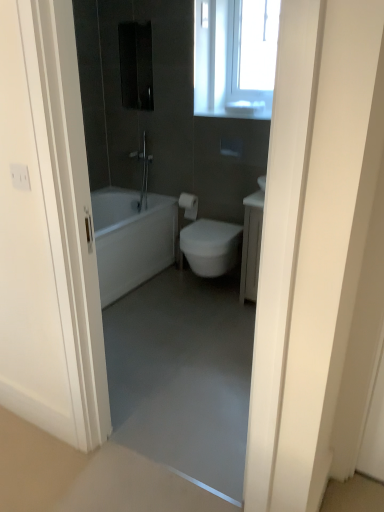
What is the approximate width of white glossy bidet at center?

white glossy bidet at center is 20.41 inches in width.

The width and height of the screenshot is (384, 512). What do you see at coordinates (257, 44) in the screenshot?
I see `transparent plastic window at upper right` at bounding box center [257, 44].

Measure the distance between point (292, 304) and camera.

They are 1.06 meters apart.

You are a GUI agent. You are given a task and a screenshot of the screen. Output one action in this format:
    pyautogui.click(x=<x>, y=<y>)
    Task: Click on the white matte toilet paper at center
    The height and width of the screenshot is (512, 384).
    Given the screenshot: What is the action you would take?
    pyautogui.click(x=189, y=205)

Is white glossy bidet at center further to the viewer compared to white matte toilet paper at center?

No, the depth of white glossy bidet at center is less than that of white matte toilet paper at center.

Measure the distance between white glossy bidet at center and white matte toilet paper at center.

white glossy bidet at center and white matte toilet paper at center are 17.94 inches apart.

Would you say white glossy bidet at center is outside white matte toilet paper at center?

Absolutely, white glossy bidet at center is external to white matte toilet paper at center.

Considering the relative sizes of white glossy bidet at center and white matte toilet paper at center in the image provided, is white glossy bidet at center wider than white matte toilet paper at center?

Correct, the width of white glossy bidet at center exceeds that of white matte toilet paper at center.

You are a GUI agent. You are given a task and a screenshot of the screen. Output one action in this format:
    pyautogui.click(x=<x>, y=<y>)
    Task: Click on the shower located on the left of transparent plastic window at upper right
    The height and width of the screenshot is (512, 384).
    Given the screenshot: What is the action you would take?
    pyautogui.click(x=143, y=172)

Considering the points (144, 164) and (245, 57), which point is behind, point (144, 164) or point (245, 57)?

The point (144, 164) is farther.

In the image, is matte silver shower at center on the left side or the right side of transparent plastic window at upper right?

Based on their positions, matte silver shower at center is located to the left of transparent plastic window at upper right.

Is matte silver shower at center far away from transparent plastic window at upper right?

matte silver shower at center is far away from transparent plastic window at upper right.

Find the location of `window screen above the white glossy bidet at center (from the image's perspective)`. window screen above the white glossy bidet at center (from the image's perspective) is located at coordinates (257, 44).

Can you tell me how much transparent plastic window at upper right and white glossy bidet at center differ in facing direction?

transparent plastic window at upper right and white glossy bidet at center are facing 1.88 degrees away from each other.

Considering the relative sizes of transparent plastic window at upper right and white glossy bidet at center in the image provided, is transparent plastic window at upper right wider than white glossy bidet at center?

In fact, transparent plastic window at upper right might be narrower than white glossy bidet at center.

Is point (243, 19) positioned in front of point (188, 237)?

That is False.

Is white matte toilet paper at center far from matte silver shower at center?

No.

Which object is positioned more to the left, white matte toilet paper at center or matte silver shower at center?

matte silver shower at center.

Considering the relative sizes of white matte toilet paper at center and matte silver shower at center in the image provided, is white matte toilet paper at center shorter than matte silver shower at center?

A: Yes.

Which object is more forward, white matte toilet paper at center or matte silver shower at center?

white matte toilet paper at center is more forward.

In the scene shown: Is white matte toilet paper at center inside or outside of white glossy bidet at center?

white matte toilet paper at center is not enclosed by white glossy bidet at center.

In the scene shown: Looking at their sizes, would you say white matte toilet paper at center is wider or thinner than white glossy bidet at center?

white matte toilet paper at center is thinner than white glossy bidet at center.

Is the position of white matte toilet paper at center less distant than that of white glossy bidet at center?

No.

Is white matte toilet paper at center with white glossy bidet at center?

No, white matte toilet paper at center is not beside white glossy bidet at center.

Can you confirm if white matte toilet paper at center is thinner than white glossy sink at upper center?

Indeed, white matte toilet paper at center has a lesser width compared to white glossy sink at upper center.

How many degrees apart are the facing directions of white matte toilet paper at center and white glossy sink at upper center?

0.00188 degrees separate the facing orientations of white matte toilet paper at center and white glossy sink at upper center.

Is white matte toilet paper at center in front of white glossy sink at upper center?

No, white matte toilet paper at center is further to the viewer.

Is white glossy sink at upper center to the left or to the right of white matte toilet paper at center in the image?

white glossy sink at upper center is to the right of white matte toilet paper at center.

Is white glossy sink at upper center facing towards white matte toilet paper at center?

No, white glossy sink at upper center is not facing towards white matte toilet paper at center.

Based on the photo, from the image's perspective, which is below, white glossy sink at upper center or white matte toilet paper at center?

white matte toilet paper at center, from the image's perspective.

Does white glossy sink at upper center lie in front of white matte toilet paper at center?

Yes.

Where is `toilet paper lying behind the white glossy bidet at center`? Image resolution: width=384 pixels, height=512 pixels. toilet paper lying behind the white glossy bidet at center is located at coordinates click(189, 205).

The width and height of the screenshot is (384, 512). I want to click on window screen on the right of the matte silver shower at center, so click(x=257, y=44).

Looking at the image, which one is located further to transparent plastic window at upper right, white glossy sink at upper center or white glossy door at upper center?

Among the two, white glossy door at upper center is located further to transparent plastic window at upper right.

Looking at the image, which one is located further to matte silver shower at center, white matte toilet paper at center or white glossy bidet at center?

white glossy bidet at center is further to matte silver shower at center.

Consider the image. Looking at the image, which one is located further to white matte toilet paper at center, white glossy bidet at center or white glossy door at upper center?

white glossy door at upper center.

Based on their spatial positions, is white glossy sink at upper center or white matte toilet paper at center further from matte silver shower at center?

Based on the image, white glossy sink at upper center appears to be further to matte silver shower at center.

Based on their spatial positions, is white glossy bidet at center or transparent plastic window at upper right closer to white glossy door at upper center?

white glossy bidet at center lies closer to white glossy door at upper center than the other object.

Considering their positions, is white matte toilet paper at center positioned further to white glossy door at upper center than white glossy bidet at center?

white matte toilet paper at center.

Looking at the image, which one is located further to matte silver shower at center, white glossy sink at upper center or transparent plastic window at upper right?

transparent plastic window at upper right.

Based on their spatial positions, is white glossy sink at upper center or white glossy bidet at center further from matte silver shower at center?

white glossy sink at upper center lies further to matte silver shower at center than the other object.

You are a GUI agent. You are given a task and a screenshot of the screen. Output one action in this format:
    pyautogui.click(x=<x>, y=<y>)
    Task: Click on the bidet positioned between white glossy door at upper center and white glossy sink at upper center from near to far
    This screenshot has width=384, height=512.
    Given the screenshot: What is the action you would take?
    click(x=211, y=246)

Image resolution: width=384 pixels, height=512 pixels. In order to click on shower between white glossy sink at upper center and white glossy bidet at center in the up-down direction in this screenshot , I will do `click(143, 172)`.

Image resolution: width=384 pixels, height=512 pixels. In order to click on toilet paper located between matte silver shower at center and white glossy sink at upper center in the left-right direction in this screenshot , I will do `click(189, 205)`.

Image resolution: width=384 pixels, height=512 pixels. What are the coordinates of `window screen between white glossy door at upper center and white matte toilet paper at center along the z-axis` in the screenshot? It's located at (257, 44).